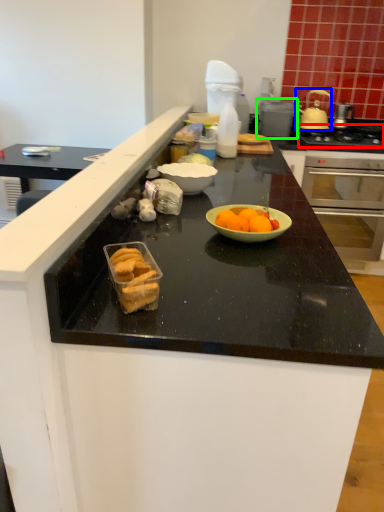
Question: Which object is the farthest from gas stove (highlighted by a red box)? Choose among these: pot/pan (highlighted by a blue box) or appliance (highlighted by a green box).

Choices:
 (A) pot/pan
 (B) appliance

Answer: (B)